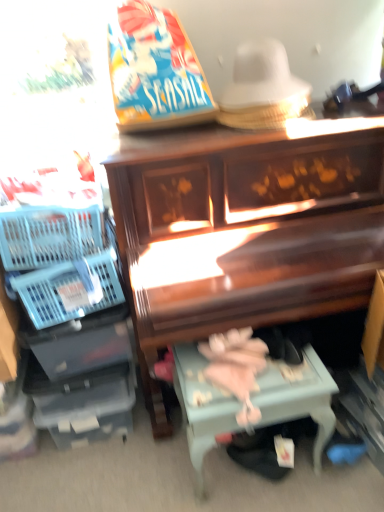
Locate an element on the screen. The width and height of the screenshot is (384, 512). free point above light blue painted wood table at lower center (from a real-world perspective) is located at coordinates (230, 385).